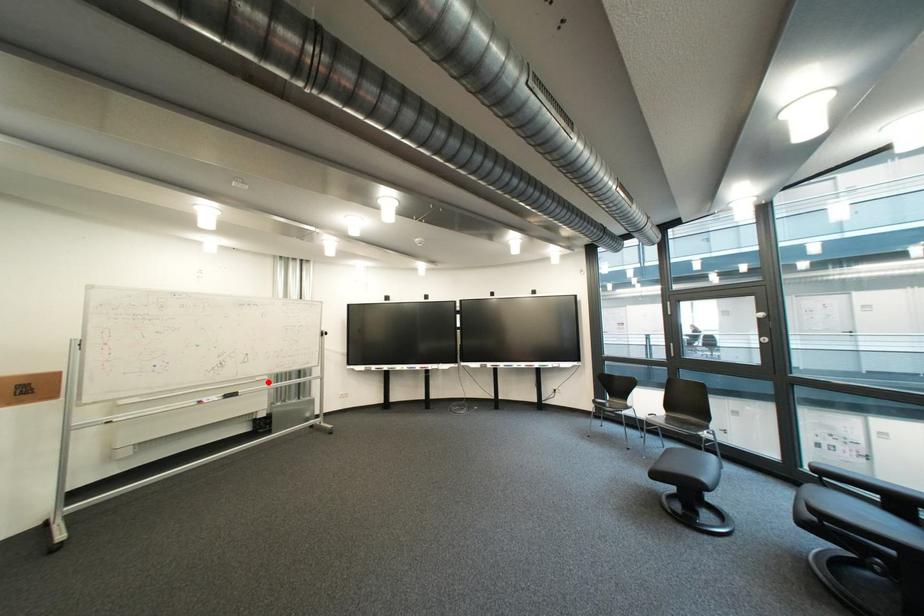
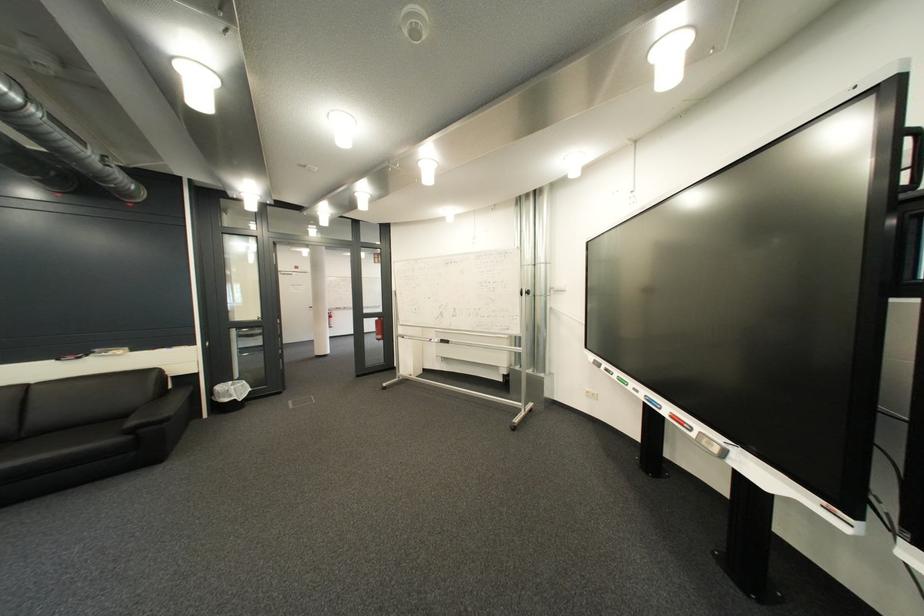
Locate, in the second image, the point that corresponds to the highlighted location in the first image.

(509, 338)